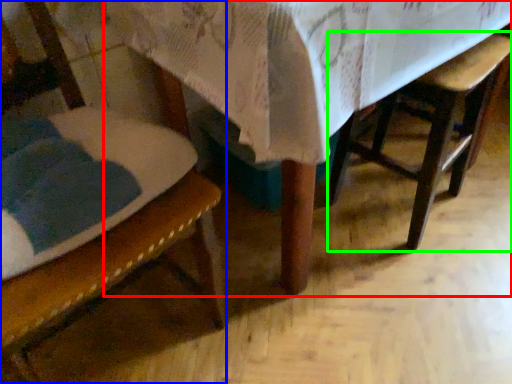
Question: Which object is positioned farthest from table (highlighted by a red box)? Select from chair (highlighted by a blue box) and armchair (highlighted by a green box).

Choices:
 (A) chair
 (B) armchair

Answer: (B)